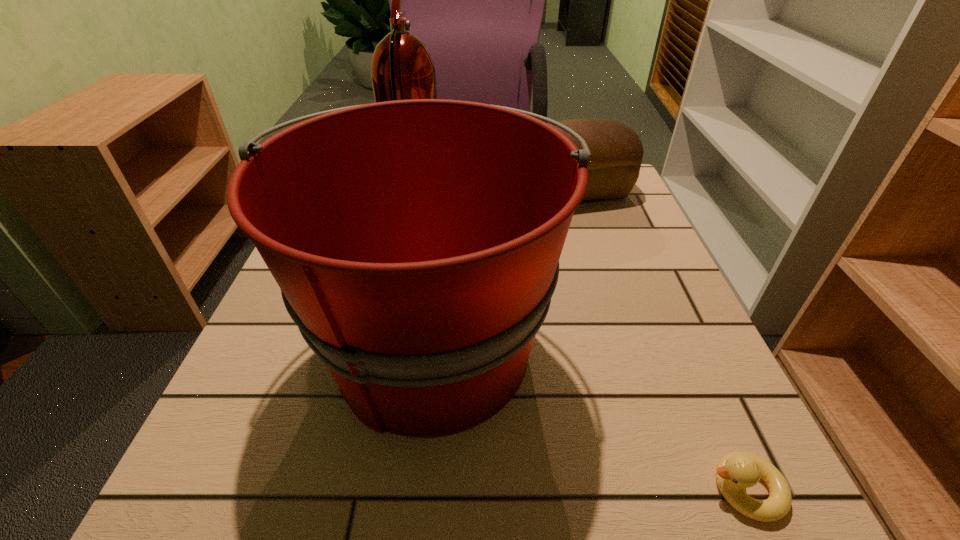
Where is `free space that satisfies the following two spatial constraints: 1. on the front-facing side of the tallest object; 2. on the right side of the second tallest object`? This screenshot has width=960, height=540. free space that satisfies the following two spatial constraints: 1. on the front-facing side of the tallest object; 2. on the right side of the second tallest object is located at coordinates (382, 347).

The image size is (960, 540). In order to click on vacant space that satisfies the following two spatial constraints: 1. on the back side of the second tallest object; 2. on the front-facing side of the fire extinguisher in this screenshot , I will do `click(449, 197)`.

At what (x,y) coordinates should I click in order to perform the action: click on free space that satisfies the following two spatial constraints: 1. on the front-facing side of the second tallest object; 2. on the right side of the fire extinguisher. Please return your answer as a coordinate pair (x, y). The image size is (960, 540). Looking at the image, I should click on (382, 347).